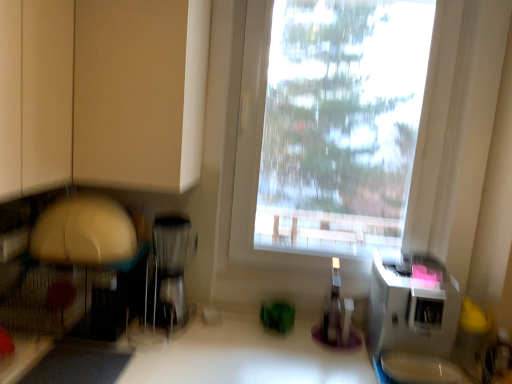
Image resolution: width=512 pixels, height=384 pixels. What do you see at coordinates (412, 319) in the screenshot?
I see `white plastic microwave at right, which ranks as the first appliance in right-to-left order` at bounding box center [412, 319].

Measure the distance between matte beige cabinet at upper left and camera.

matte beige cabinet at upper left and camera are 37.65 inches apart from each other.

Measure the distance between transparent plastic bottle at center and camera.

A distance of 1.52 meters exists between transparent plastic bottle at center and camera.

Where is `transparent plastic window at center`? This screenshot has width=512, height=384. transparent plastic window at center is located at coordinates (342, 129).

This screenshot has width=512, height=384. In order to click on white plastic microwave at right, which ranks as the first appliance in right-to-left order in this screenshot , I will do `click(412, 319)`.

Is white plastic microwave at right, which ranks as the first appliance in right-to-left order, at the left side of transparent plastic bottle at center?

Incorrect, white plastic microwave at right, which ranks as the first appliance in right-to-left order, is not on the left side of transparent plastic bottle at center.

From the picture: From a real-world perspective, is white plastic microwave at right, which ranks as the first appliance in right-to-left order, positioned above or below transparent plastic bottle at center?

In terms of real-world spatial position, white plastic microwave at right, which ranks as the first appliance in right-to-left order, is above transparent plastic bottle at center.

Which point is more distant from viewer, (409,331) or (340,325)?

The point (340,325) is farther.

What's the angular difference between white plastic microwave at right, which ranks as the first appliance in right-to-left order, and transparent plastic bottle at center's facing directions?

There is a 0.000437-degree angle between the facing directions of white plastic microwave at right, which ranks as the first appliance in right-to-left order, and transparent plastic bottle at center.

How distant is matte beige cabinet at upper left from white plastic microwave at right, arranged as the second appliance when viewed from the left?

matte beige cabinet at upper left is 37.91 inches away from white plastic microwave at right, arranged as the second appliance when viewed from the left.

In the scene shown: Considering the relative sizes of matte beige cabinet at upper left and white plastic microwave at right, which ranks as the first appliance in right-to-left order, in the image provided, is matte beige cabinet at upper left smaller than white plastic microwave at right, which ranks as the first appliance in right-to-left order,?

No.

Is matte beige cabinet at upper left in front of or behind white plastic microwave at right, arranged as the second appliance when viewed from the left, in the image?

matte beige cabinet at upper left is behind white plastic microwave at right, arranged as the second appliance when viewed from the left.

Consider the image. Is matte beige cabinet at upper left in contact with white plastic microwave at right, which ranks as the first appliance in right-to-left order?

No, matte beige cabinet at upper left is not beside white plastic microwave at right, which ranks as the first appliance in right-to-left order.

You are a GUI agent. You are given a task and a screenshot of the screen. Output one action in this format:
    pyautogui.click(x=<x>, y=<y>)
    Task: Click on the cabinetry on the left of the white plastic microwave at right, which ranks as the first appliance in right-to-left order
    
    Given the screenshot: What is the action you would take?
    pyautogui.click(x=102, y=93)

Based on the photo, from the image's perspective, is white plastic microwave at right, which ranks as the first appliance in right-to-left order, below matte beige cabinet at upper left?

Yes.

Does point (384, 325) come farther from viewer compared to point (123, 17)?

Yes, point (384, 325) is behind point (123, 17).

Can you confirm if transparent plastic window at center is smaller than satin silver coffee maker at center, the first appliance when ordered from left to right?

Actually, transparent plastic window at center might be larger than satin silver coffee maker at center, the first appliance when ordered from left to right.

Consider the image. Is transparent plastic window at center not within satin silver coffee maker at center, marked as the second appliance in a right-to-left arrangement?

Indeed, transparent plastic window at center is completely outside satin silver coffee maker at center, marked as the second appliance in a right-to-left arrangement.

What's the angular difference between transparent plastic window at center and satin silver coffee maker at center, the first appliance when ordered from left to right,'s facing directions?

transparent plastic window at center and satin silver coffee maker at center, the first appliance when ordered from left to right, are facing 8.22e-05 degrees away from each other.

Could you tell me if transparent plastic window at center is facing satin silver coffee maker at center, marked as the second appliance in a right-to-left arrangement?

No, transparent plastic window at center is not facing towards satin silver coffee maker at center, marked as the second appliance in a right-to-left arrangement.

Is matte beige cabinet at upper left to the left of satin silver coffee maker at center, the first appliance when ordered from left to right, from the viewer's perspective?

Yes, matte beige cabinet at upper left is to the left of satin silver coffee maker at center, the first appliance when ordered from left to right.

Are matte beige cabinet at upper left and satin silver coffee maker at center, the first appliance when ordered from left to right, far apart?

No, matte beige cabinet at upper left is in close proximity to satin silver coffee maker at center, the first appliance when ordered from left to right.

From the picture: Is matte beige cabinet at upper left wider than satin silver coffee maker at center, the first appliance when ordered from left to right?

Indeed, matte beige cabinet at upper left has a greater width compared to satin silver coffee maker at center, the first appliance when ordered from left to right.

Would you say satin silver coffee maker at center, the first appliance when ordered from left to right, is part of matte beige cabinet at upper left's contents?

No, satin silver coffee maker at center, the first appliance when ordered from left to right, is located outside of matte beige cabinet at upper left.

From a real-world perspective, is transparent plastic window at center positioned above or below transparent plastic bottle at center?

From a real-world perspective, transparent plastic window at center is physically above transparent plastic bottle at center.

Consider the image. Who is bigger, transparent plastic window at center or transparent plastic bottle at center?

transparent plastic window at center.

Is transparent plastic window at center positioned beyond the bounds of white plastic microwave at right, which ranks as the first appliance in right-to-left order?

transparent plastic window at center is positioned outside white plastic microwave at right, which ranks as the first appliance in right-to-left order.

Visually, is transparent plastic window at center positioned to the left or to the right of white plastic microwave at right, arranged as the second appliance when viewed from the left?

From the image, it's evident that transparent plastic window at center is to the left of white plastic microwave at right, arranged as the second appliance when viewed from the left.

From a real-world perspective, is transparent plastic window at center over white plastic microwave at right, which ranks as the first appliance in right-to-left order?

Yes, from a real-world perspective, transparent plastic window at center is above white plastic microwave at right, which ranks as the first appliance in right-to-left order.

From the image's perspective, which is below, transparent plastic window at center or white plastic microwave at right, which ranks as the first appliance in right-to-left order?

white plastic microwave at right, which ranks as the first appliance in right-to-left order, from the image's perspective.

This screenshot has height=384, width=512. In the image, there is a transparent plastic bottle at center. In order to click on appliance below it (from the image's perspective) in this screenshot , I will do `click(412, 319)`.

Image resolution: width=512 pixels, height=384 pixels. In the image, there is a white plastic microwave at right, arranged as the second appliance when viewed from the left. Identify the location of cabinetry above it (from the image's perspective). (102, 93).

Looking at the image, which one is located closer to transparent plastic bottle at center, white plastic microwave at right, arranged as the second appliance when viewed from the left, or matte beige cabinet at upper left?

The object closer to transparent plastic bottle at center is white plastic microwave at right, arranged as the second appliance when viewed from the left.

Considering their positions, is transparent plastic window at center positioned closer to satin silver coffee maker at center, marked as the second appliance in a right-to-left arrangement, than transparent plastic bottle at center?

transparent plastic window at center lies closer to satin silver coffee maker at center, marked as the second appliance in a right-to-left arrangement, than the other object.

Looking at this image, considering their positions, is matte beige cabinet at upper left positioned closer to white plastic microwave at right, arranged as the second appliance when viewed from the left, than satin silver coffee maker at center, marked as the second appliance in a right-to-left arrangement?

satin silver coffee maker at center, marked as the second appliance in a right-to-left arrangement, is positioned closer to the anchor white plastic microwave at right, arranged as the second appliance when viewed from the left.

Based on their spatial positions, is matte beige cabinet at upper left or transparent plastic bottle at center closer to satin silver coffee maker at center, marked as the second appliance in a right-to-left arrangement?

Among the two, matte beige cabinet at upper left is located nearer to satin silver coffee maker at center, marked as the second appliance in a right-to-left arrangement.

From the picture: Considering their positions, is satin silver coffee maker at center, the first appliance when ordered from left to right, positioned closer to transparent plastic window at center than white plastic microwave at right, arranged as the second appliance when viewed from the left?

Among the two, white plastic microwave at right, arranged as the second appliance when viewed from the left, is located nearer to transparent plastic window at center.

From the image, which object appears to be farther from transparent plastic bottle at center, white plastic microwave at right, which ranks as the first appliance in right-to-left order, or transparent plastic window at center?

Among the two, transparent plastic window at center is located further to transparent plastic bottle at center.

Based on their spatial positions, is transparent plastic bottle at center or satin silver coffee maker at center, marked as the second appliance in a right-to-left arrangement, closer to matte beige cabinet at upper left?

satin silver coffee maker at center, marked as the second appliance in a right-to-left arrangement, is closer to matte beige cabinet at upper left.

When comparing their distances from satin silver coffee maker at center, marked as the second appliance in a right-to-left arrangement, does matte beige cabinet at upper left or transparent plastic window at center seem further?

matte beige cabinet at upper left.

Where is `window situated between matte beige cabinet at upper left and white plastic microwave at right, arranged as the second appliance when viewed from the left, from left to right`? window situated between matte beige cabinet at upper left and white plastic microwave at right, arranged as the second appliance when viewed from the left, from left to right is located at coordinates pos(342,129).

The height and width of the screenshot is (384, 512). In order to click on bottle between matte beige cabinet at upper left and white plastic microwave at right, which ranks as the first appliance in right-to-left order in this screenshot , I will do `click(332, 309)`.

You are a GUI agent. You are given a task and a screenshot of the screen. Output one action in this format:
    pyautogui.click(x=<x>, y=<y>)
    Task: Click on the window that lies between matte beige cabinet at upper left and transparent plastic bottle at center from top to bottom
    The image size is (512, 384).
    Given the screenshot: What is the action you would take?
    pyautogui.click(x=342, y=129)

You are a GUI agent. You are given a task and a screenshot of the screen. Output one action in this format:
    pyautogui.click(x=<x>, y=<y>)
    Task: Click on the bottle between transparent plastic window at center and white plastic microwave at right, arranged as the second appliance when viewed from the left, in the vertical direction
    The height and width of the screenshot is (384, 512).
    Given the screenshot: What is the action you would take?
    [x=332, y=309]